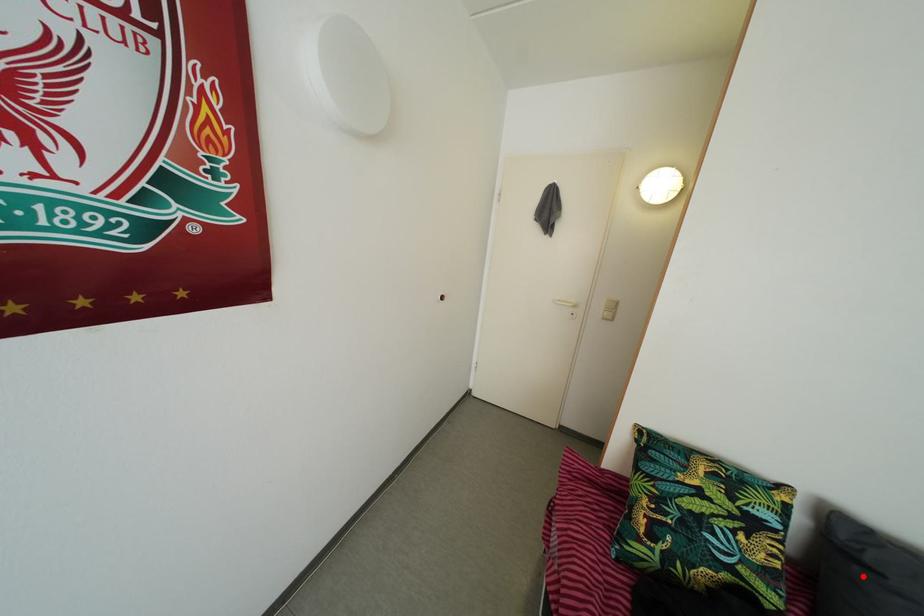
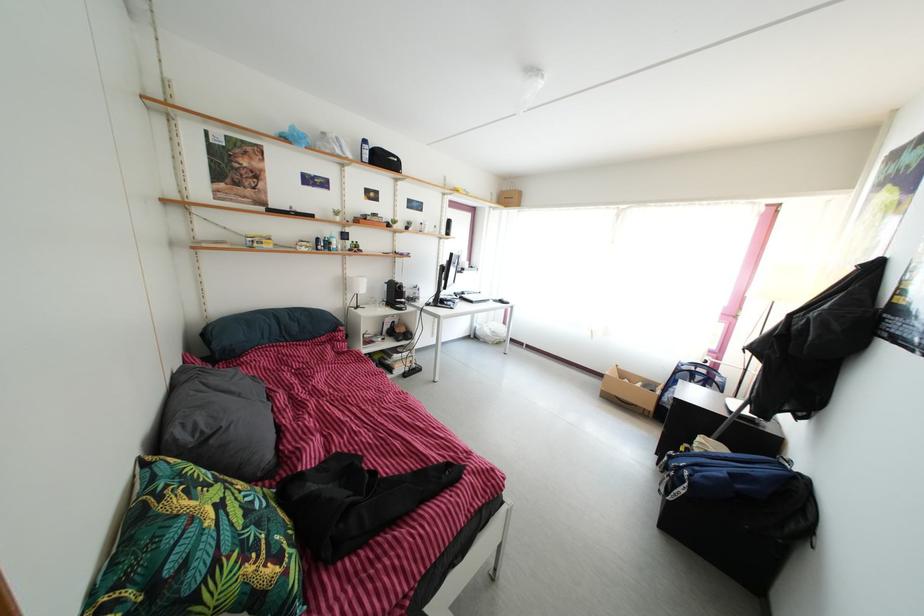
Question: I am providing you with two images of the same scene from different viewpoints. In image1, a red point is highlighted. Considering the same 3D point in image2, which of the following is correct?

Choices:
 (A) It is closer
 (B) It is farther

Answer: (B)